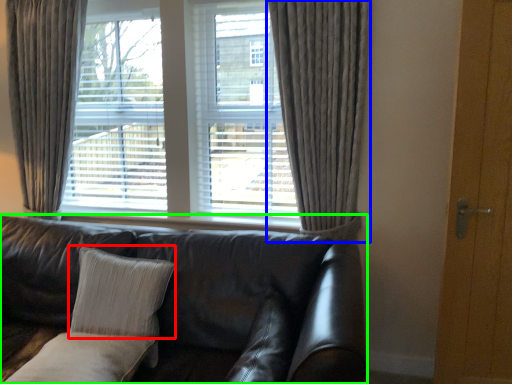
Question: Based on their relative distances, which object is nearer to pillow (highlighted by a red box)? Choose from curtain (highlighted by a blue box) and studio couch (highlighted by a green box).

Choices:
 (A) curtain
 (B) studio couch

Answer: (B)